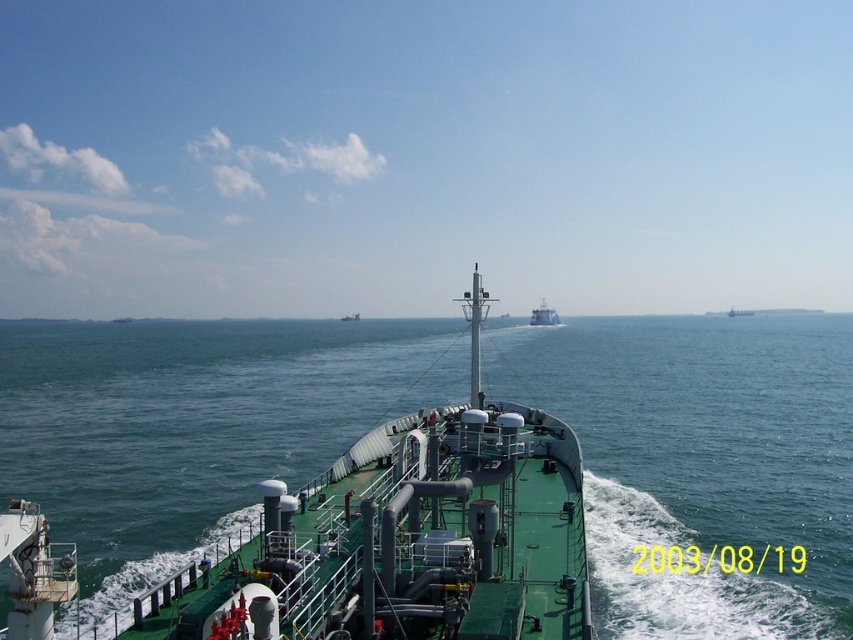
You are standing on the deck of the ship and see two points marked on the water. The first point is at coordinates point (x=532, y=310) and the second is at point (x=347, y=317). If you are facing the direction the ship is moving, which point is closer to you?

Point (x=532, y=310) is in front of point (x=347, y=317), so when facing the ship, the point (x=532, y=310) is closer to you.

You are standing on the deck of the ship and looking forward. Which object, the green water at center or the white glossy boat at center, appears nearer to you?

The green water at center appears nearer to you because it is closer to the viewer than the white glossy boat at center according to the description.

You are a photographer trying to capture the white glossy boat at center in the image. Since the green water at center takes up more space, will the boat be easy to spot in the photo?

The green water at center is bigger than the white glossy boat at center, so the boat might be harder to spot as it is smaller in the frame.